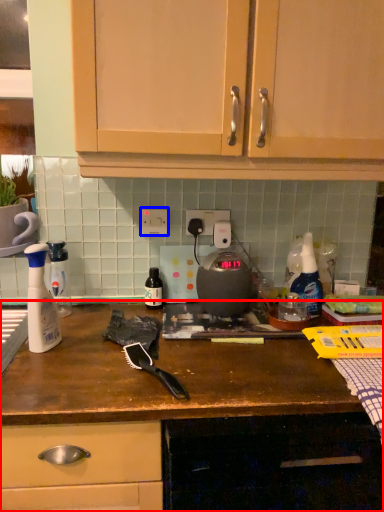
Question: Which object is further to the camera taking this photo, cabinetry (highlighted by a red box) or electric outlet (highlighted by a blue box)?

Choices:
 (A) cabinetry
 (B) electric outlet

Answer: (B)